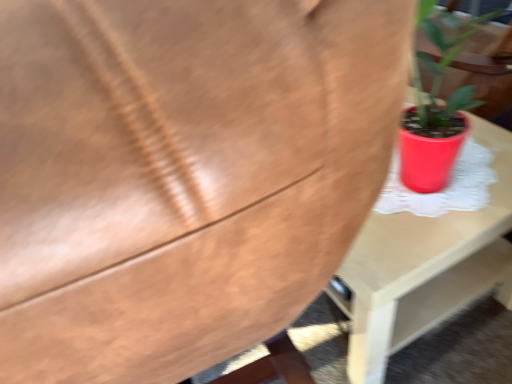
Identify the location of vacant space situated above matte plastic table at right (from a real-world perspective). (445, 183).